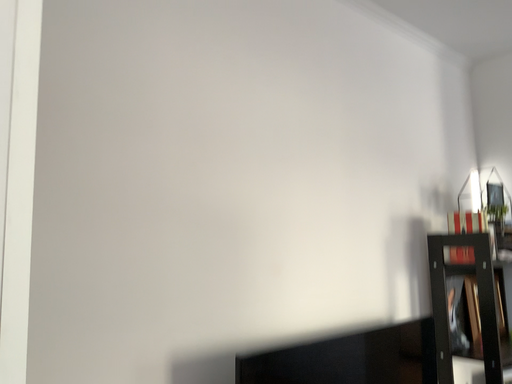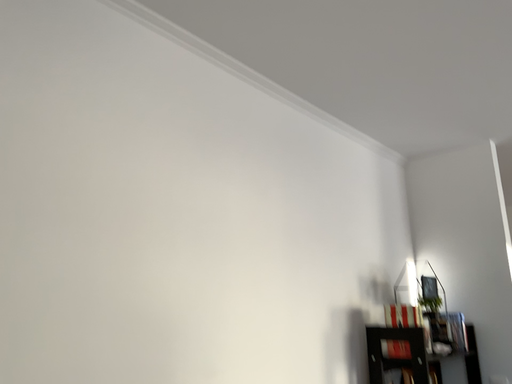
Question: Which way did the camera rotate in the video?

Choices:
 (A) rotated left
 (B) rotated right

Answer: (B)